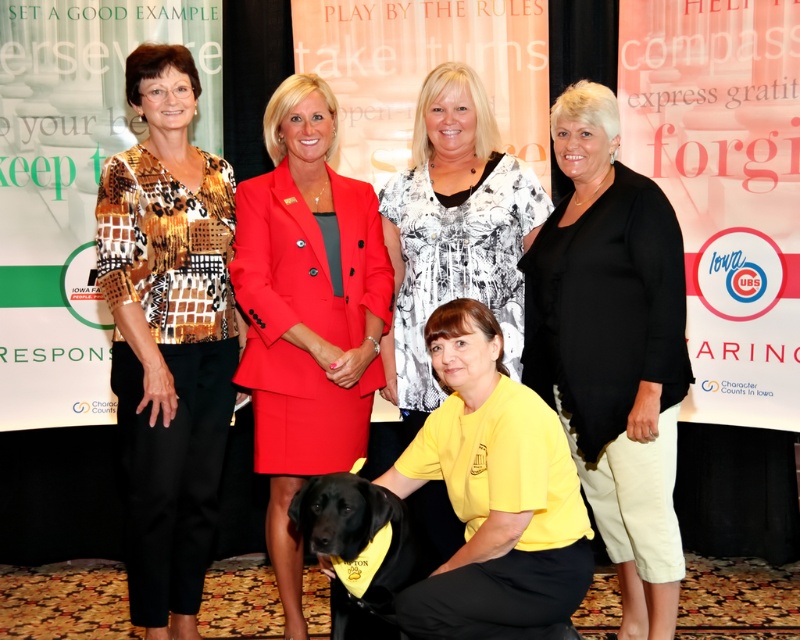
You are a photographer adjusting your camera settings. You notice two points in the image at coordinates point (324, 116) and point (402, 172). Which point is closer to your camera lens?

Point (324, 116) is closer to the camera lens than point (402, 172).

You are a photographer who needs to adjust the lighting to highlight the matte red blazer at center. Based on its position in the image, where should you focus the light? Provide coordinates as a point in the form of a tuple like this example format, e.g., 0.489, 0.384

The 2D location of the matte red blazer at center is at point (306, 312), so you should focus the light at that coordinate.